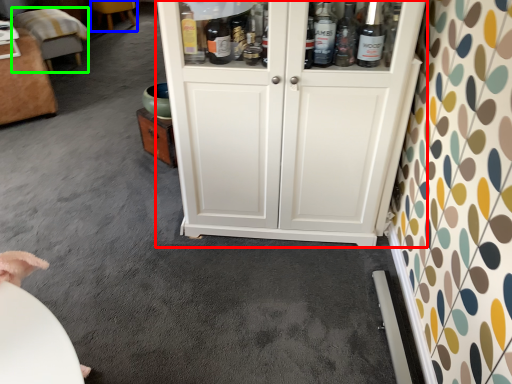
Question: Estimate the real-world distances between objects in this image. Which object is farther from cupboard (highlighted by a red box), furniture (highlighted by a blue box) or furniture (highlighted by a green box)?

Choices:
 (A) furniture
 (B) furniture

Answer: (A)